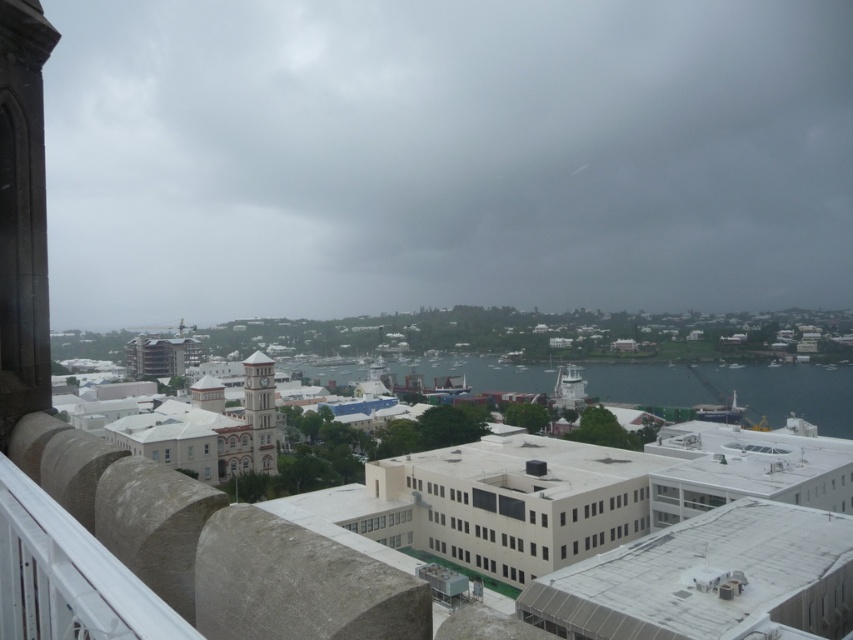
Does clear water at center have a lesser height compared to white stone clock tower at center?

Indeed, clear water at center has a lesser height compared to white stone clock tower at center.

Is clear water at center smaller than white stone clock tower at center?

No.

The image size is (853, 640). Describe the element at coordinates (788, 392) in the screenshot. I see `clear water at center` at that location.

At what (x,y) coordinates should I click in order to perform the action: click on clear water at center. Please return your answer as a coordinate pair (x, y). The height and width of the screenshot is (640, 853). Looking at the image, I should click on (788, 392).